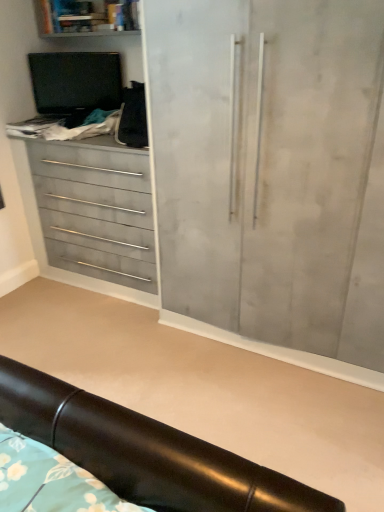
Question: Can you confirm if black leather headboard at lower center is bigger than matte gray drawers at left?

Choices:
 (A) yes
 (B) no

Answer: (B)

Question: Is black leather headboard at lower center at the right side of matte gray drawers at left?

Choices:
 (A) no
 (B) yes

Answer: (B)

Question: Considering the relative sizes of black leather headboard at lower center and matte gray drawers at left in the image provided, is black leather headboard at lower center thinner than matte gray drawers at left?

Choices:
 (A) no
 (B) yes

Answer: (A)

Question: Is black leather headboard at lower center at the left side of matte gray drawers at left?

Choices:
 (A) yes
 (B) no

Answer: (B)

Question: From a real-world perspective, is black leather headboard at lower center over matte gray drawers at left?

Choices:
 (A) no
 (B) yes

Answer: (A)

Question: Considering the positions of black leather headboard at lower center and matte gray drawers at left in the image, is black leather headboard at lower center taller or shorter than matte gray drawers at left?

Choices:
 (A) tall
 (B) short

Answer: (B)

Question: Is black leather headboard at lower center bigger or smaller than matte gray drawers at left?

Choices:
 (A) big
 (B) small

Answer: (B)

Question: From a real-world perspective, relative to matte gray drawers at left, is black leather headboard at lower center vertically above or below?

Choices:
 (A) below
 (B) above

Answer: (A)

Question: Considering the positions of black leather headboard at lower center and matte gray drawers at left in the image, is black leather headboard at lower center wider or thinner than matte gray drawers at left?

Choices:
 (A) thin
 (B) wide

Answer: (B)

Question: Is black leather headboard at lower center situated inside matte gray shelf at upper left or outside?

Choices:
 (A) inside
 (B) outside

Answer: (B)

Question: From their relative heights in the image, would you say black leather headboard at lower center is taller or shorter than matte gray shelf at upper left?

Choices:
 (A) tall
 (B) short

Answer: (B)

Question: Does point (150, 486) appear closer or farther from the camera than point (99, 22)?

Choices:
 (A) closer
 (B) farther

Answer: (A)

Question: Considering their positions, is black leather headboard at lower center located in front of or behind matte gray shelf at upper left?

Choices:
 (A) behind
 (B) front

Answer: (B)

Question: Considering the positions of black leather headboard at lower center and matte gray cupboard at center in the image, is black leather headboard at lower center wider or thinner than matte gray cupboard at center?

Choices:
 (A) wide
 (B) thin

Answer: (A)

Question: Is point (82, 398) positioned closer to the camera than point (210, 259)?

Choices:
 (A) closer
 (B) farther

Answer: (A)